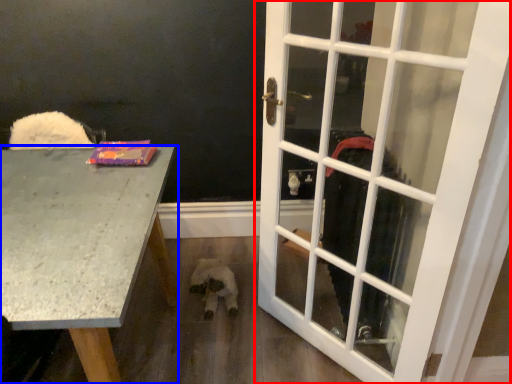
Question: Which object is further to the camera taking this photo, door (highlighted by a red box) or desk (highlighted by a blue box)?

Choices:
 (A) door
 (B) desk

Answer: (A)